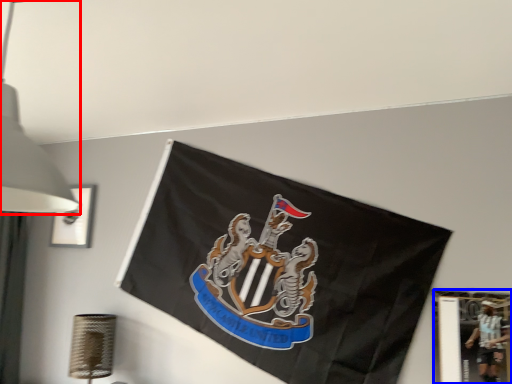
Question: Among these objects, which one is farthest to the camera, lamp (highlighted by a red box) or picture frame (highlighted by a blue box)?

Choices:
 (A) lamp
 (B) picture frame

Answer: (B)